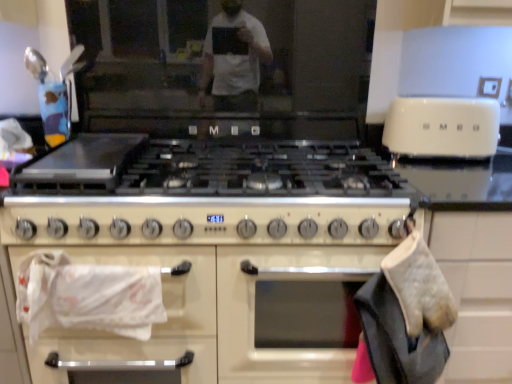
Question: Is white glossy toaster at upper right a part of white glossy towel at lower left?

Choices:
 (A) yes
 (B) no

Answer: (B)

Question: Can you confirm if white glossy towel at lower left is smaller than white glossy toaster at upper right?

Choices:
 (A) no
 (B) yes

Answer: (B)

Question: Is white glossy towel at lower left beside white glossy toaster at upper right?

Choices:
 (A) yes
 (B) no

Answer: (B)

Question: Would you say white glossy towel at lower left is outside white glossy toaster at upper right?

Choices:
 (A) yes
 (B) no

Answer: (A)

Question: Are white glossy towel at lower left and white glossy toaster at upper right located far from each other?

Choices:
 (A) yes
 (B) no

Answer: (B)

Question: Can you confirm if white glossy towel at lower left is shorter than white glossy toaster at upper right?

Choices:
 (A) no
 (B) yes

Answer: (A)

Question: Does white glossy toaster at upper right have a greater width compared to white glossy towel at lower left?

Choices:
 (A) yes
 (B) no

Answer: (A)

Question: Is white glossy toaster at upper right closer to the viewer compared to white glossy towel at lower left?

Choices:
 (A) no
 (B) yes

Answer: (A)

Question: Can you confirm if white glossy toaster at upper right is shorter than white glossy towel at lower left?

Choices:
 (A) yes
 (B) no

Answer: (A)

Question: Is white glossy toaster at upper right not inside white glossy towel at lower left?

Choices:
 (A) yes
 (B) no

Answer: (A)

Question: Is white glossy toaster at upper right next to white glossy towel at lower left and touching it?

Choices:
 (A) yes
 (B) no

Answer: (B)

Question: Would you say white glossy toaster at upper right contains white glossy towel at lower left?

Choices:
 (A) no
 (B) yes

Answer: (A)

Question: From a real-world perspective, is white glossy toaster at upper right above or below white glossy towel at lower left?

Choices:
 (A) above
 (B) below

Answer: (A)